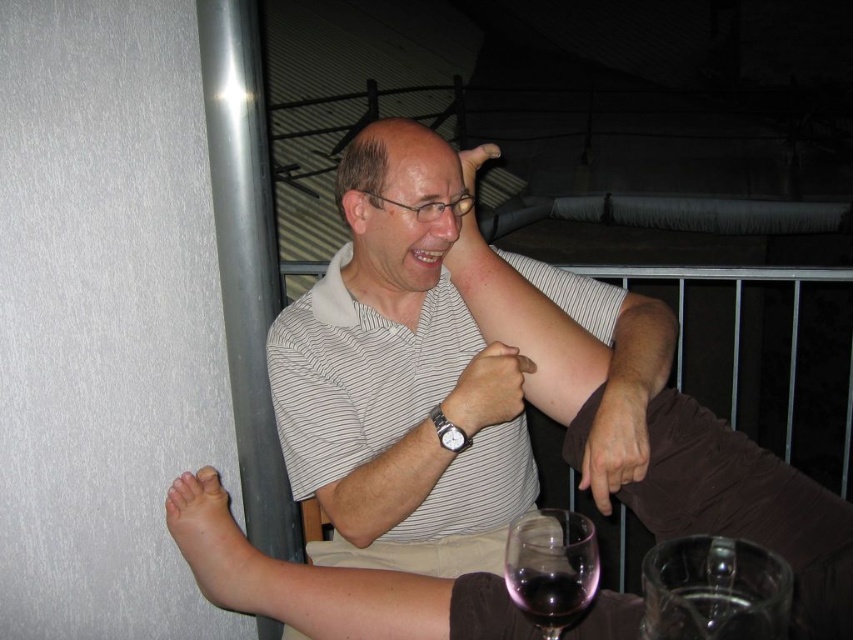
Between transparent glass at lower center and silver metallic watch at center, which one has more height?

transparent glass at lower center

Is point (552, 634) positioned in front of point (450, 445)?

Yes, point (552, 634) is closer to viewer.

Is point (535, 538) less distant than point (448, 420)?

Yes, point (535, 538) is closer to viewer.

Image resolution: width=853 pixels, height=640 pixels. Identify the location of transparent glass at lower center. (550, 566).

Who is lower down, striped cotton shirt at center or transparent glass at lower center?

transparent glass at lower center is lower down.

Consider the image. Is striped cotton shirt at center bigger than transparent glass at lower center?

Correct, striped cotton shirt at center is larger in size than transparent glass at lower center.

Is point (286, 362) positioned behind point (564, 582)?

Yes, it is behind point (564, 582).

The width and height of the screenshot is (853, 640). In order to click on striped cotton shirt at center in this screenshot , I will do `click(358, 374)`.

Image resolution: width=853 pixels, height=640 pixels. What do you see at coordinates (358, 374) in the screenshot?
I see `striped cotton shirt at center` at bounding box center [358, 374].

Who is more forward, (346, 304) or (447, 438)?

Point (447, 438) is in front.

What are the coordinates of `striped cotton shirt at center` in the screenshot? It's located at (358, 374).

You are a GUI agent. You are given a task and a screenshot of the screen. Output one action in this format:
    pyautogui.click(x=<x>, y=<y>)
    Task: Click on the striped cotton shirt at center
    The image size is (853, 640).
    Given the screenshot: What is the action you would take?
    pyautogui.click(x=358, y=374)